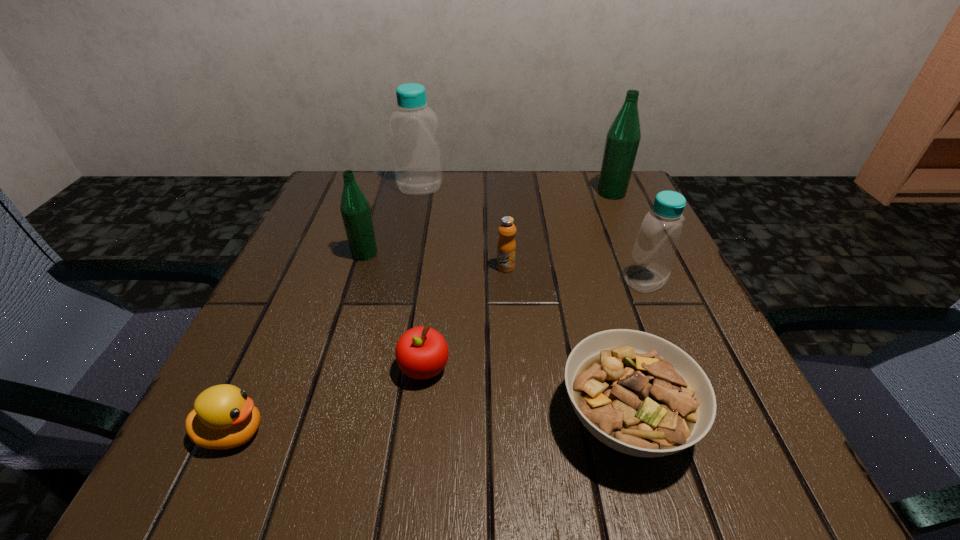
The width and height of the screenshot is (960, 540). Find the location of `the bigger blue bottle`. the bigger blue bottle is located at coordinates (417, 159).

Find the location of a particular element. Image resolution: width=960 pixels, height=540 pixels. the left blue bottle is located at coordinates (417, 159).

The width and height of the screenshot is (960, 540). Find the location of `the right green bottle`. the right green bottle is located at coordinates (623, 138).

The height and width of the screenshot is (540, 960). In order to click on the bigger green bottle in this screenshot , I will do `click(623, 138)`.

You are a GUI agent. You are given a task and a screenshot of the screen. Output one action in this format:
    pyautogui.click(x=<x>, y=<y>)
    Task: Click on the nearest bottle
    
    Given the screenshot: What is the action you would take?
    pyautogui.click(x=656, y=244)

The width and height of the screenshot is (960, 540). Identify the location of the right blue bottle. (656, 244).

This screenshot has height=540, width=960. In order to click on the nearer green bottle in this screenshot , I will do `click(355, 209)`.

You are a GUI agent. You are given a task and a screenshot of the screen. Output one action in this format:
    pyautogui.click(x=<x>, y=<y>)
    Task: Click on the left green bottle
    The width and height of the screenshot is (960, 540).
    Given the screenshot: What is the action you would take?
    pyautogui.click(x=355, y=209)

Locate an element on the screen. The width and height of the screenshot is (960, 540). the fifth object from left to right is located at coordinates (506, 247).

Identify the location of the fourth shortest object. (506, 247).